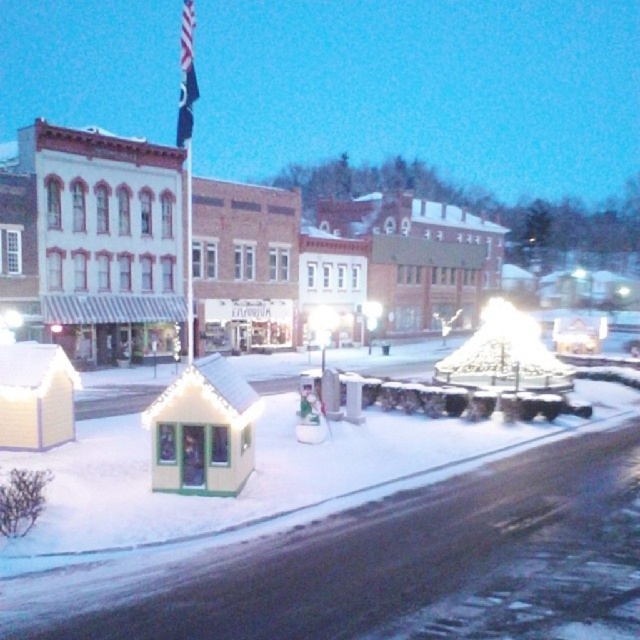
Who is positioned more to the right, brick building at center or black fabric flag at upper center?

brick building at center is more to the right.

Does brick building at center have a greater height compared to black fabric flag at upper center?

No, brick building at center is not taller than black fabric flag at upper center.

Is point (216, 269) positioned behind point (189, 76)?

No, it is in front of (189, 76).

This screenshot has width=640, height=640. I want to click on brick building at center, so click(x=333, y=266).